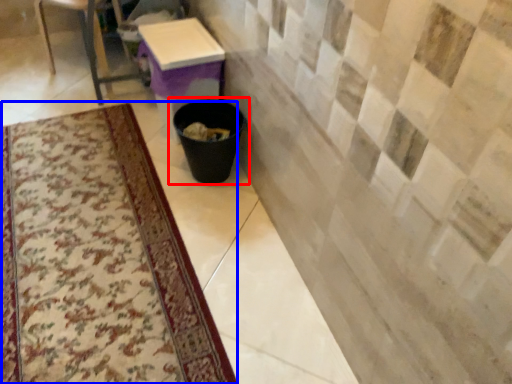
Question: Among these objects, which one is farthest to the camera, waste container (highlighted by a red box) or mat (highlighted by a blue box)?

Choices:
 (A) waste container
 (B) mat

Answer: (A)